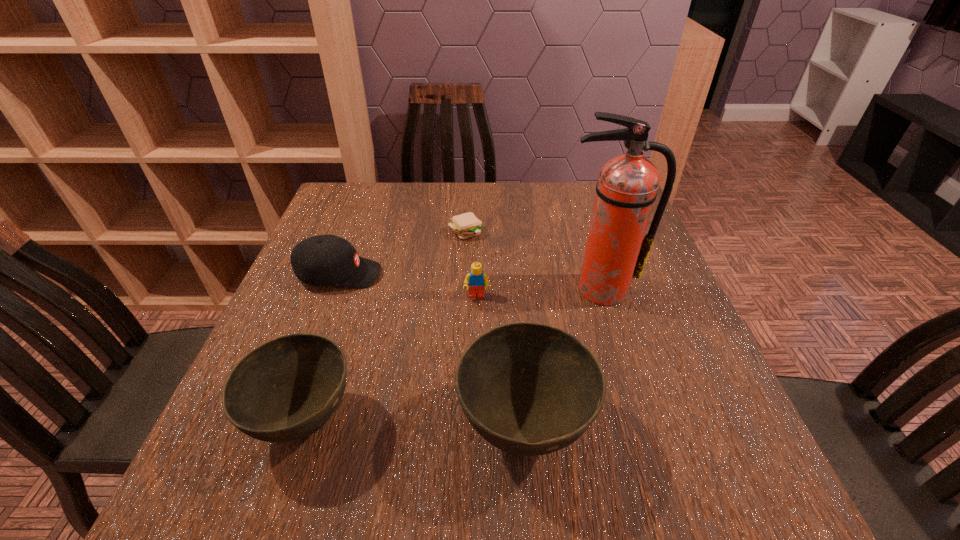
Observe the arrangement of all bowls in the image. To keep them evenly spaced, where would you place another bowl on the right? Please locate a free space. Please provide its 2D coordinates. Your answer should be formatted as a tuple, i.e. [(x, y)], where the tuple contains the x and y coordinates of a point satisfying the conditions above.

[(749, 437)]